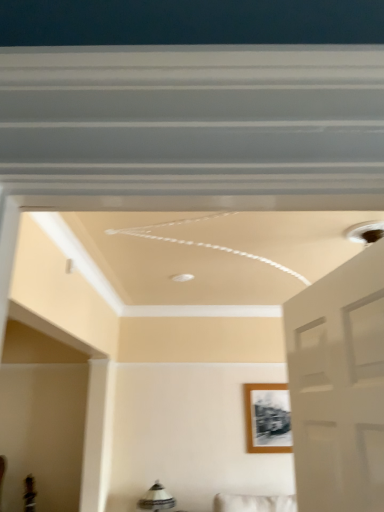
Question: Considering the relative sizes of wooden photo frame at center and white glossy lampshade at lower center in the image provided, is wooden photo frame at center bigger than white glossy lampshade at lower center?

Choices:
 (A) yes
 (B) no

Answer: (B)

Question: Is wooden photo frame at center oriented away from white glossy lampshade at lower center?

Choices:
 (A) no
 (B) yes

Answer: (A)

Question: Is wooden photo frame at center thinner than white glossy lampshade at lower center?

Choices:
 (A) no
 (B) yes

Answer: (B)

Question: Can you confirm if wooden photo frame at center is smaller than white glossy lampshade at lower center?

Choices:
 (A) yes
 (B) no

Answer: (A)

Question: From a real-world perspective, is wooden photo frame at center under white glossy lampshade at lower center?

Choices:
 (A) no
 (B) yes

Answer: (A)

Question: From the image's perspective, is wooden photo frame at center located above white glossy lampshade at lower center?

Choices:
 (A) no
 (B) yes

Answer: (B)

Question: Can you confirm if white glossy lampshade at lower center is thinner than wooden photo frame at center?

Choices:
 (A) yes
 (B) no

Answer: (B)

Question: Are white glossy lampshade at lower center and wooden photo frame at center making contact?

Choices:
 (A) no
 (B) yes

Answer: (A)

Question: Is white glossy lampshade at lower center turned away from wooden photo frame at center?

Choices:
 (A) no
 (B) yes

Answer: (A)

Question: From a real-world perspective, is white glossy lampshade at lower center on wooden photo frame at center?

Choices:
 (A) no
 (B) yes

Answer: (A)

Question: From the image's perspective, does white glossy lampshade at lower center appear lower than wooden photo frame at center?

Choices:
 (A) yes
 (B) no

Answer: (A)

Question: Can you confirm if white glossy lampshade at lower center is smaller than wooden photo frame at center?

Choices:
 (A) yes
 (B) no

Answer: (B)

Question: From a real-world perspective, is wooden photo frame at center positioned above or below white glossy lampshade at lower center?

Choices:
 (A) below
 (B) above

Answer: (B)